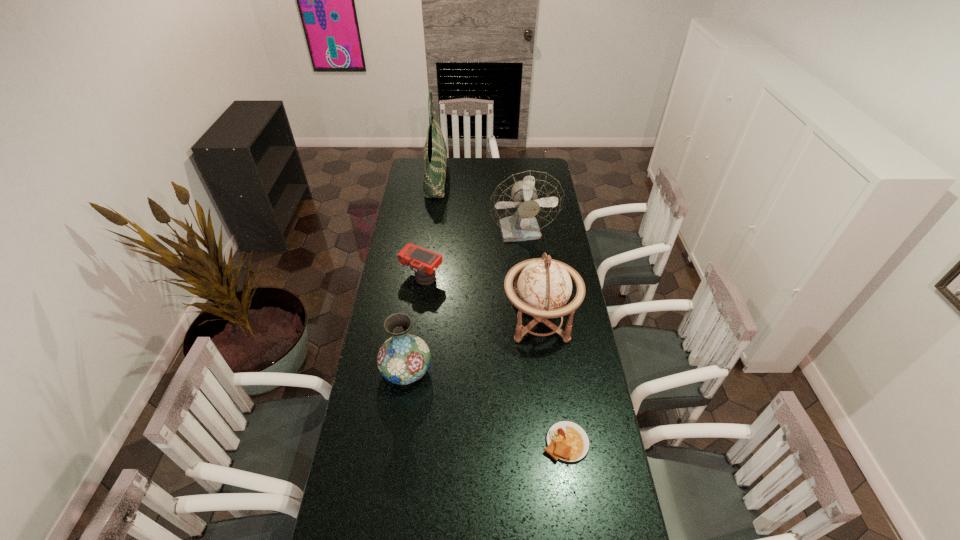
The height and width of the screenshot is (540, 960). I want to click on free spot located in front of the fan to blow air, so click(529, 295).

Image resolution: width=960 pixels, height=540 pixels. In order to click on vacant region located at the front of the globe showing Africa in this screenshot , I will do (451, 321).

Find the location of `free region located 0.140m at the front of the globe showing Africa`. free region located 0.140m at the front of the globe showing Africa is located at coordinates (468, 321).

This screenshot has height=540, width=960. Find the location of `free space located at the front of the globe showing Africa`. free space located at the front of the globe showing Africa is located at coordinates (449, 321).

The image size is (960, 540). Identify the location of blank area located 0.120m on the front of the fourth tallest object. (399, 424).

Where is `vacant space positioned on the front of the third farthest object`? This screenshot has width=960, height=540. vacant space positioned on the front of the third farthest object is located at coordinates (415, 329).

At what (x,y) coordinates should I click in order to perform the action: click on free location located on the left of the nearest object. Please return your answer as a coordinate pair (x, y). The image size is (960, 540). Looking at the image, I should click on (475, 442).

Identify the location of object at the far edge. This screenshot has height=540, width=960. (435, 152).

This screenshot has width=960, height=540. What are the coordinates of `tote bag that is positioned at the left edge` in the screenshot? It's located at (435, 152).

The width and height of the screenshot is (960, 540). In order to click on vase at the left edge in this screenshot , I will do `click(404, 358)`.